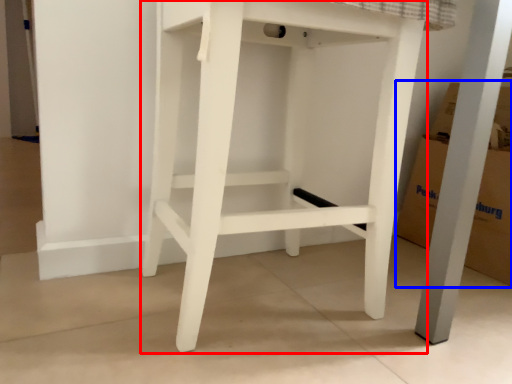
Question: Which object appears closest to the camera in this image, furniture (highlighted by a red box) or cardboard box (highlighted by a blue box)?

Choices:
 (A) furniture
 (B) cardboard box

Answer: (A)